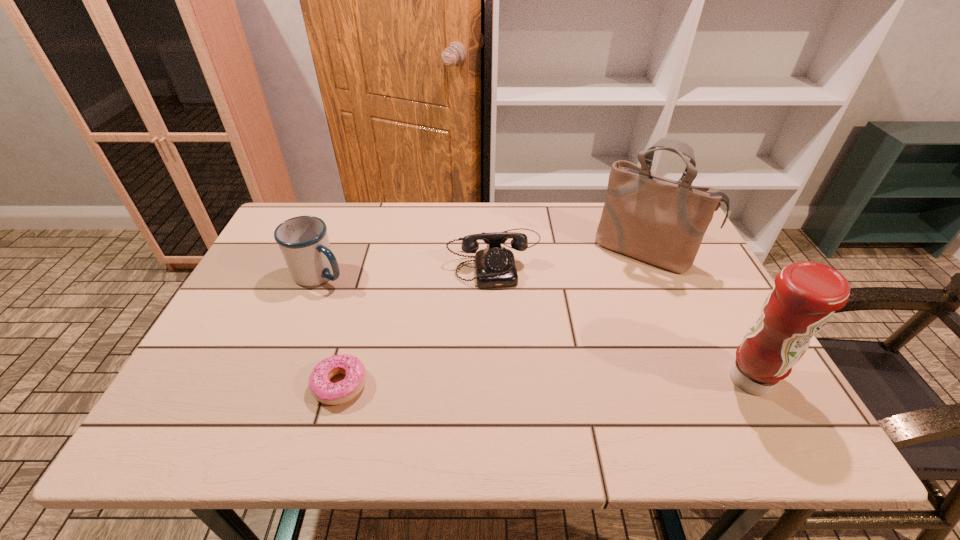
Locate an element on the screen. telephone present at the far edge is located at coordinates (495, 267).

Locate an element on the screen. doughnut that is positioned at the near edge is located at coordinates (321, 388).

Find the location of `condiment that is at the near edge`. condiment that is at the near edge is located at coordinates (806, 295).

Identify the location of object present at the left edge. (303, 240).

Image resolution: width=960 pixels, height=540 pixels. In order to click on condiment that is at the right edge in this screenshot , I will do `click(806, 295)`.

You are a GUI agent. You are given a task and a screenshot of the screen. Output one action in this format:
    pyautogui.click(x=<x>, y=<y>)
    Task: Click on the shoulder bag that is at the right edge
    
    Given the screenshot: What is the action you would take?
    pyautogui.click(x=657, y=220)

Identify the location of object positioned at the far right corner. (657, 220).

This screenshot has height=540, width=960. Find the location of `object that is at the near right corner`. object that is at the near right corner is located at coordinates (806, 295).

Image resolution: width=960 pixels, height=540 pixels. What are the coordinates of `free location at the far edge of the desktop` in the screenshot? It's located at (385, 244).

The width and height of the screenshot is (960, 540). In the image, there is a desktop. What are the coordinates of `vacant space at the near edge` in the screenshot? It's located at (582, 400).